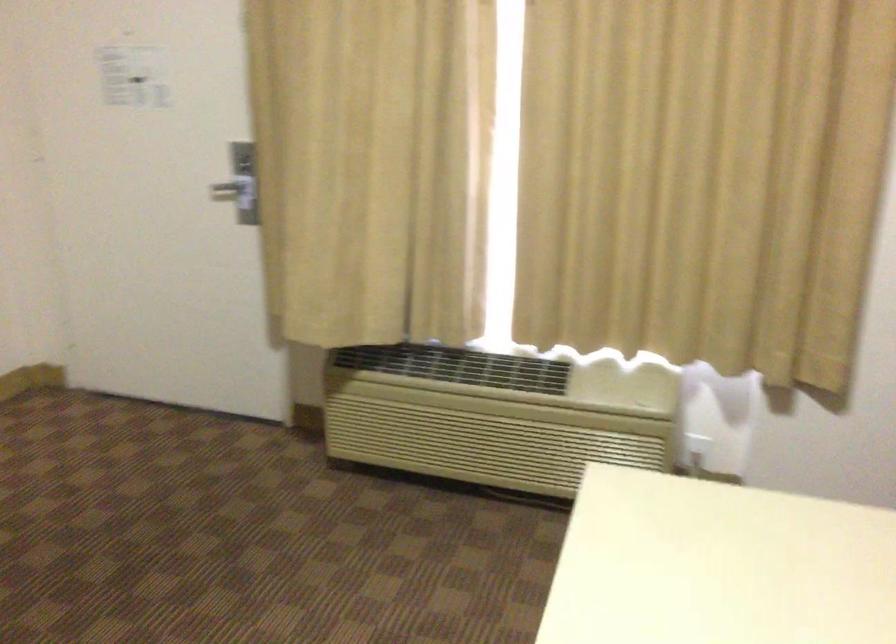
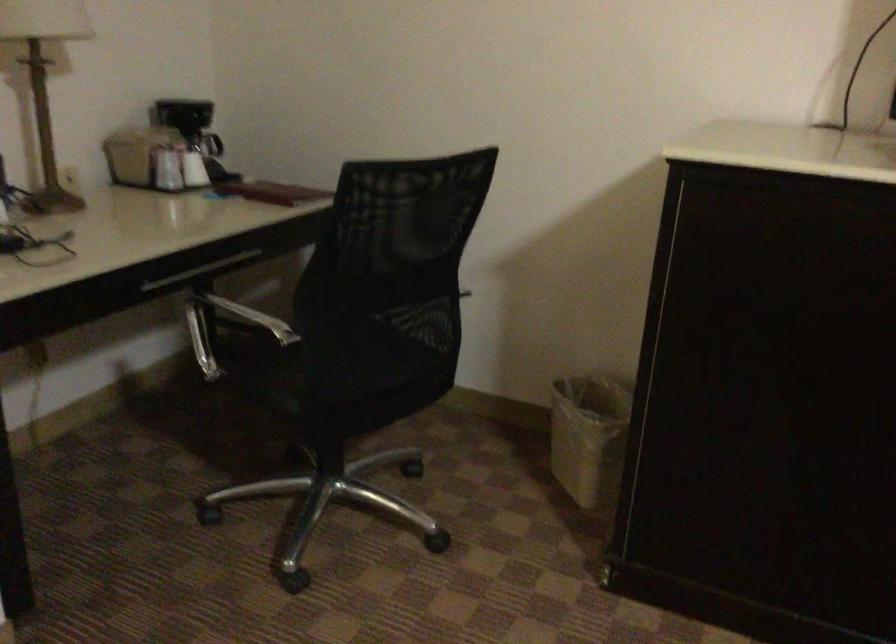
The images are taken continuously from a first-person perspective. In which direction is your viewpoint rotating?

The rotation direction of the camera is left-down.